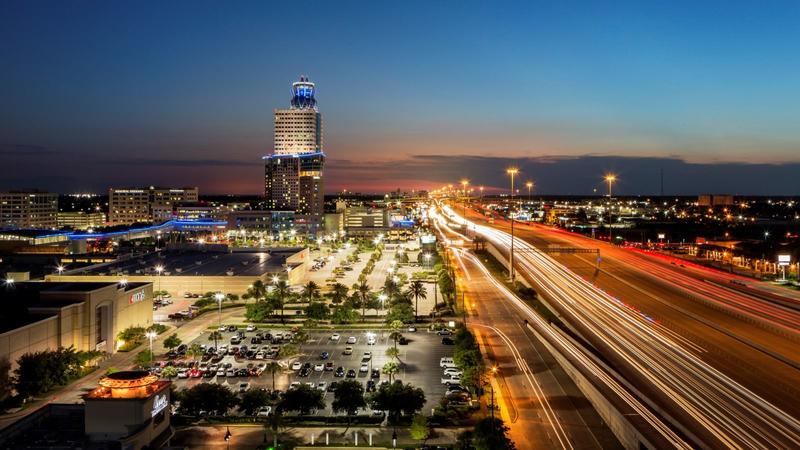
This screenshot has width=800, height=450. In order to click on lights in this screenshot , I will do `click(368, 340)`, `click(146, 340)`, `click(57, 268)`, `click(217, 300)`.